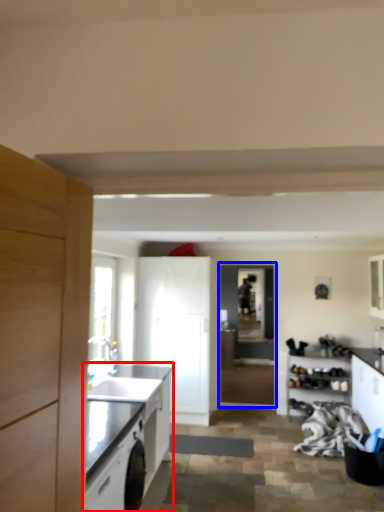
Question: Among these objects, which one is farthest to the camera, cabinetry (highlighted by a red box) or glass door (highlighted by a blue box)?

Choices:
 (A) cabinetry
 (B) glass door

Answer: (B)